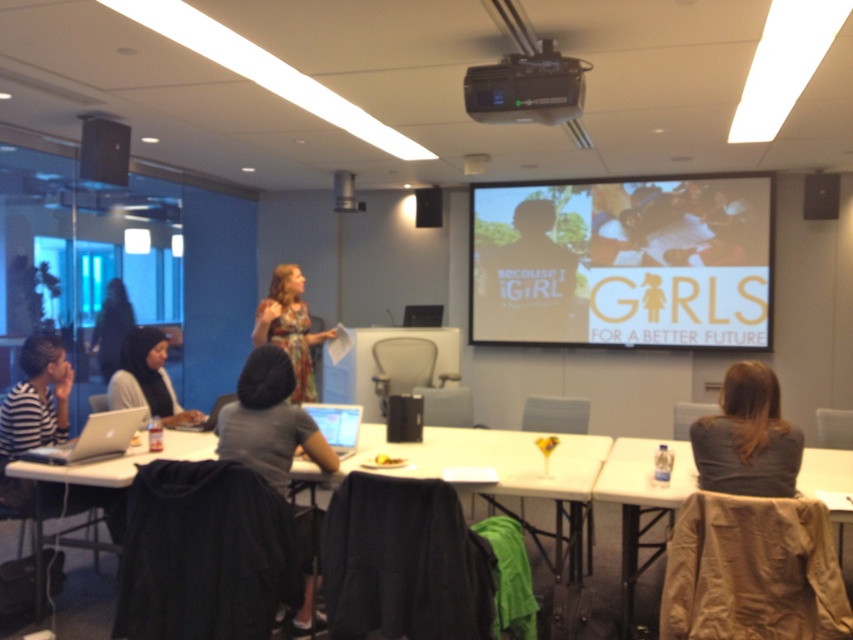
Can you confirm if white glossy poster at center is positioned below silver metallic laptop at lower left?

Actually, white glossy poster at center is above silver metallic laptop at lower left.

Does white glossy poster at center have a greater height compared to silver metallic laptop at lower left?

Yes, white glossy poster at center is taller than silver metallic laptop at lower left.

Identify the location of white glossy poster at center. (524, 282).

Can you confirm if matte white projector screen at upper center is shorter than white glossy poster at center?

In fact, matte white projector screen at upper center may be taller than white glossy poster at center.

Which is behind, point (546, 184) or point (500, 289)?

Positioned behind is point (500, 289).

Which is in front, point (529, 301) or point (491, 308)?

Point (529, 301) is more forward.

Where is `matte white projector screen at upper center`? This screenshot has width=853, height=640. matte white projector screen at upper center is located at coordinates (622, 262).

What are the coordinates of `white plastic table at lower center` in the screenshot? It's located at (489, 460).

Can you confirm if white plastic table at lower center is smaller than white plastic table at lower right?

Indeed, white plastic table at lower center has a smaller size compared to white plastic table at lower right.

Who is more forward, (105, 472) or (682, 445)?

Point (105, 472) is in front.

The image size is (853, 640). In order to click on white plastic table at lower center in this screenshot , I will do `click(489, 460)`.